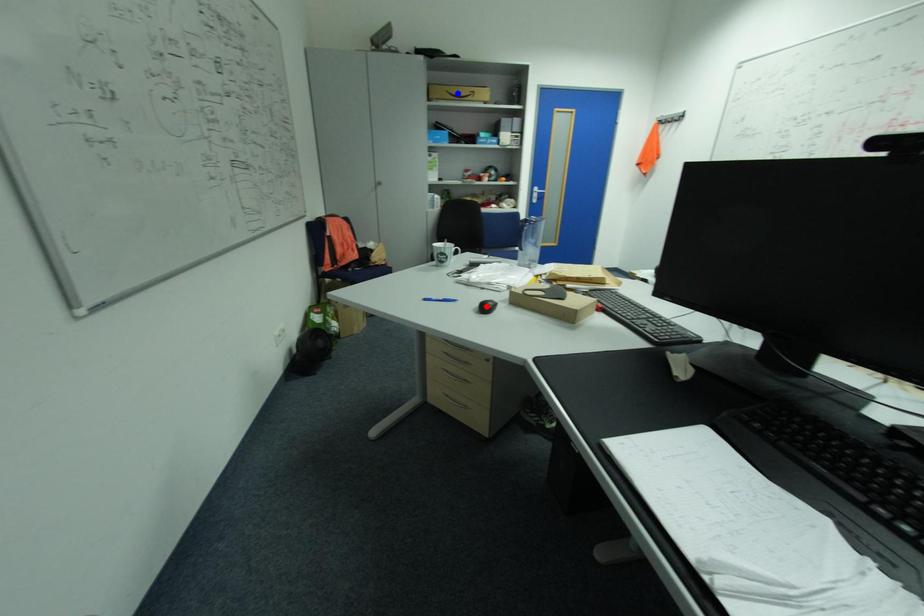
Question: Which of the two points in the image is closer to the camera?

Choices:
 (A) Blue point is closer.
 (B) Red point is closer.

Answer: (B)